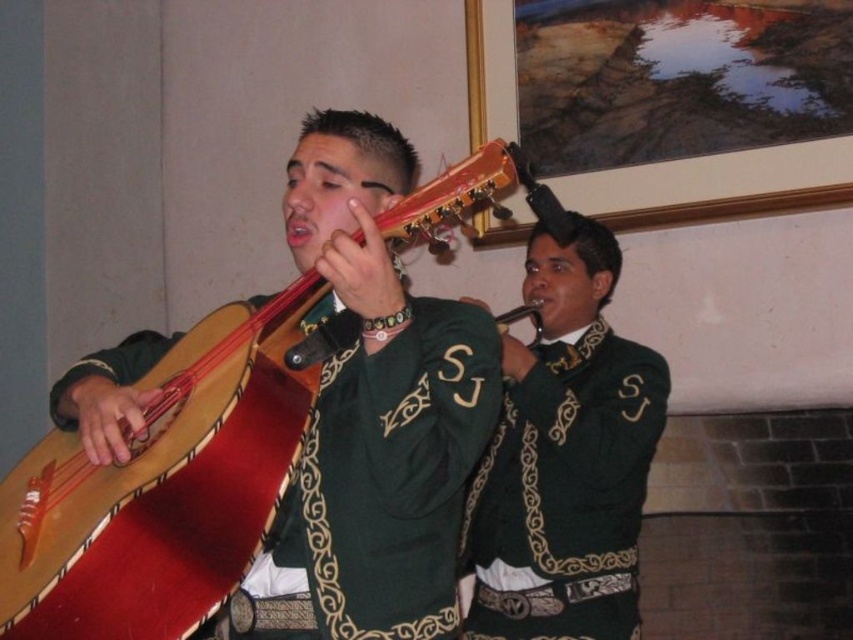
Describe the element at coordinates (161, 488) in the screenshot. The image size is (853, 640). I see `wooden acoustic guitar at left` at that location.

Is wooden acoustic guitar at left below green matte jacket at center?

Actually, wooden acoustic guitar at left is above green matte jacket at center.

Identify the location of wooden acoustic guitar at left. (161, 488).

Measure the distance between wooden acoustic guitar at left and camera.

1.34 meters

Is wooden acoustic guitar at left bigger than green velvet vest at center?

Indeed, wooden acoustic guitar at left has a larger size compared to green velvet vest at center.

Is point (32, 502) behind point (419, 552)?

That is True.

This screenshot has width=853, height=640. I want to click on wooden acoustic guitar at left, so click(x=161, y=488).

Is green velvet vest at center wider than green matte jacket at center?

Incorrect, green velvet vest at center's width does not surpass green matte jacket at center's.

What do you see at coordinates (380, 486) in the screenshot? The height and width of the screenshot is (640, 853). I see `green velvet vest at center` at bounding box center [380, 486].

In order to click on green velvet vest at center in this screenshot , I will do `click(380, 486)`.